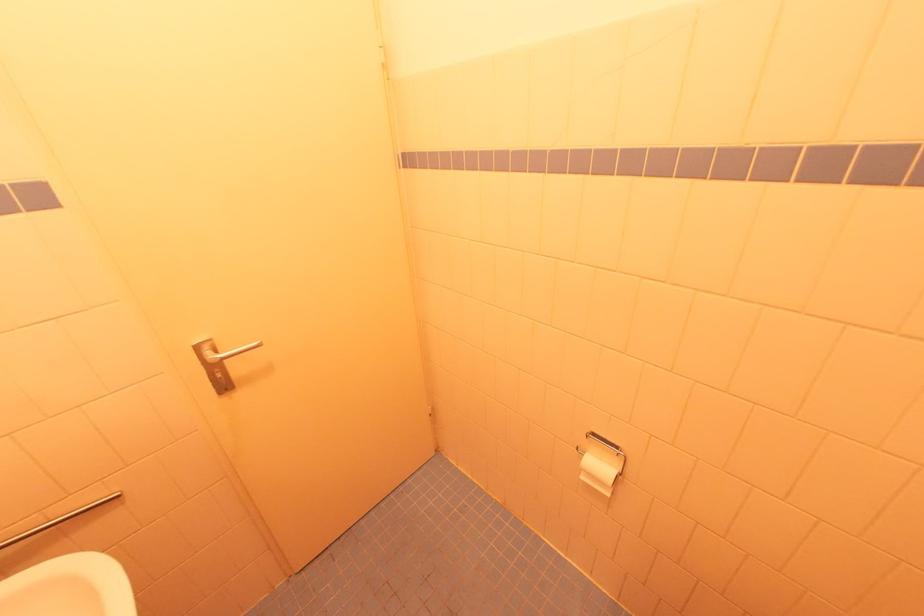
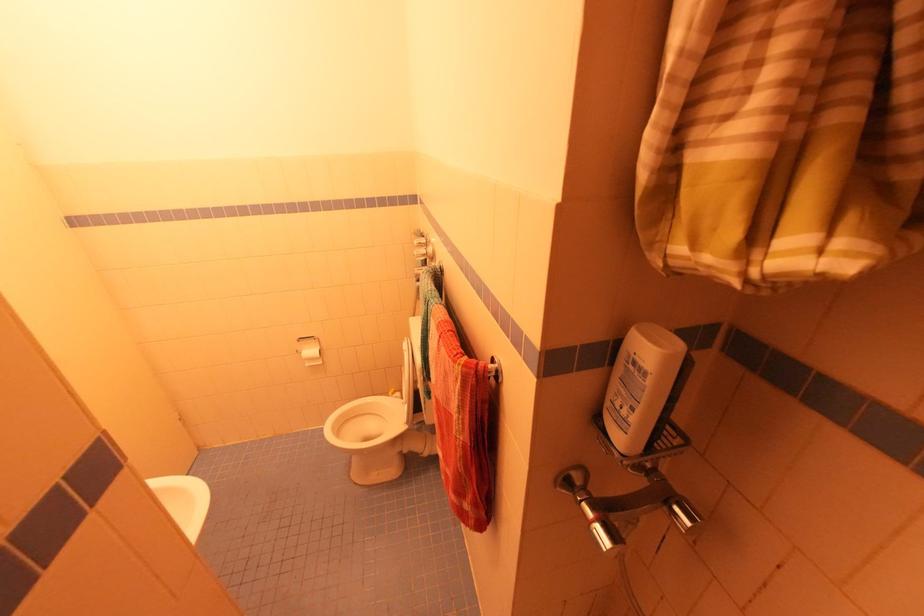
The point at (619, 448) is marked in the first image. Where is the corresponding point in the second image?

(314, 338)